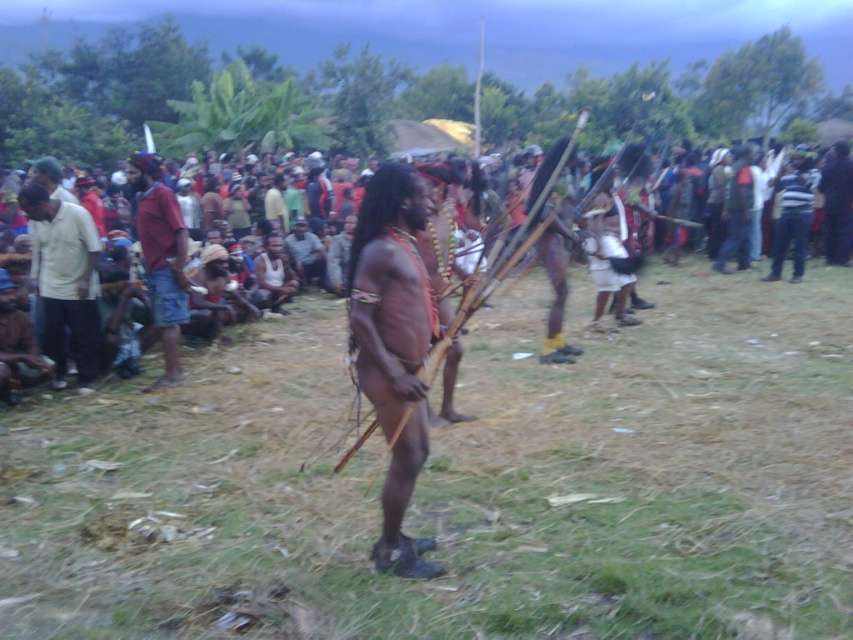
Which is in front, point (70, 308) or point (178, 230)?

Point (178, 230) is more forward.

Can you confirm if white shirt at left is bigger than red fabric shirt at left?

Actually, white shirt at left might be smaller than red fabric shirt at left.

Who is more forward, (73, 225) or (154, 280)?

Point (154, 280) is more forward.

Locate an element on the screen. This screenshot has width=853, height=640. white shirt at left is located at coordinates (64, 282).

Is brown skin/unclothed man at center closer to the viewer compared to red fabric shirt at left?

Yes, it is.

Find the location of a particular element. The image size is (853, 640). brown skin/unclothed man at center is located at coordinates (393, 346).

Where is `brown skin/unclothed man at center`? brown skin/unclothed man at center is located at coordinates (393, 346).